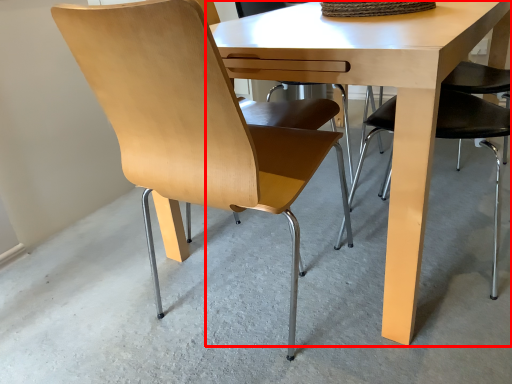
Question: From the image's perspective, what is the correct spatial relationship of table (annotated by the red box) in relation to chair?

Choices:
 (A) below
 (B) above

Answer: (B)